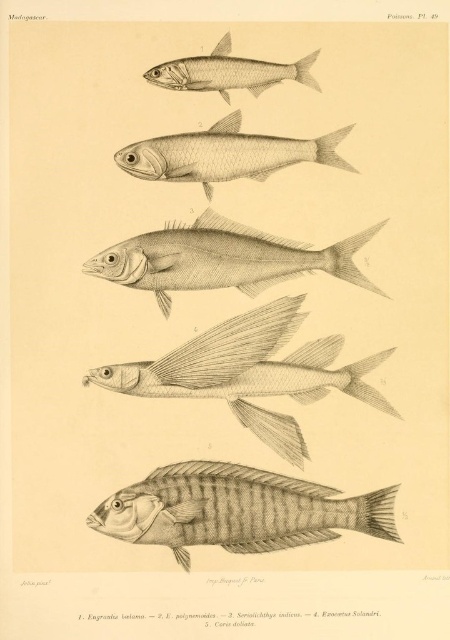
You are an art student analyzing the illustration. You notice a point marked at coordinates [251,372]. Which fish in the illustration is this point indicating?

The point at coordinates [251,372] marks the gray pencil sketch of fish at upper center.